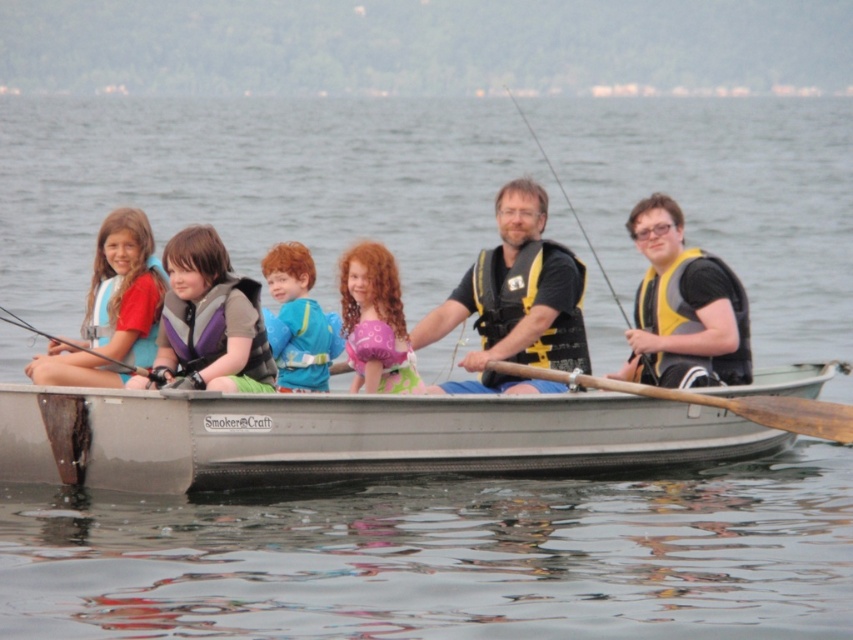
Question: Is purple life vest at center below matte blue life vest at left?

Choices:
 (A) no
 (B) yes

Answer: (B)

Question: From the image, what is the correct spatial relationship of black/yellow life vest at center in relation to brown wood paddle at center?

Choices:
 (A) below
 (B) above

Answer: (B)

Question: Which of the following is the closest to the observer?

Choices:
 (A) (379, 364)
 (B) (244, 365)
 (C) (618, 305)
 (D) (509, 317)

Answer: (B)

Question: Does metallic gray boat at center appear under yellow/black life vest at center?

Choices:
 (A) no
 (B) yes

Answer: (B)

Question: Which point is farther to the camera?

Choices:
 (A) [x=193, y=371]
 (B) [x=285, y=243]

Answer: (B)

Question: Estimate the real-world distances between objects in this image. Which object is closer to the metallic gray boat at center?

Choices:
 (A) black/yellow life vest at center
 (B) yellow/black life vest at center

Answer: (A)